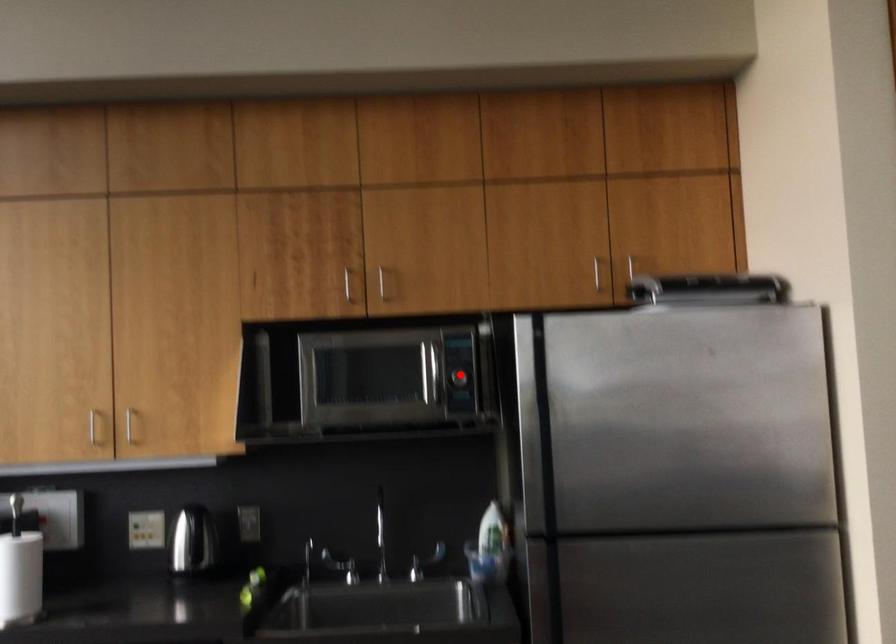
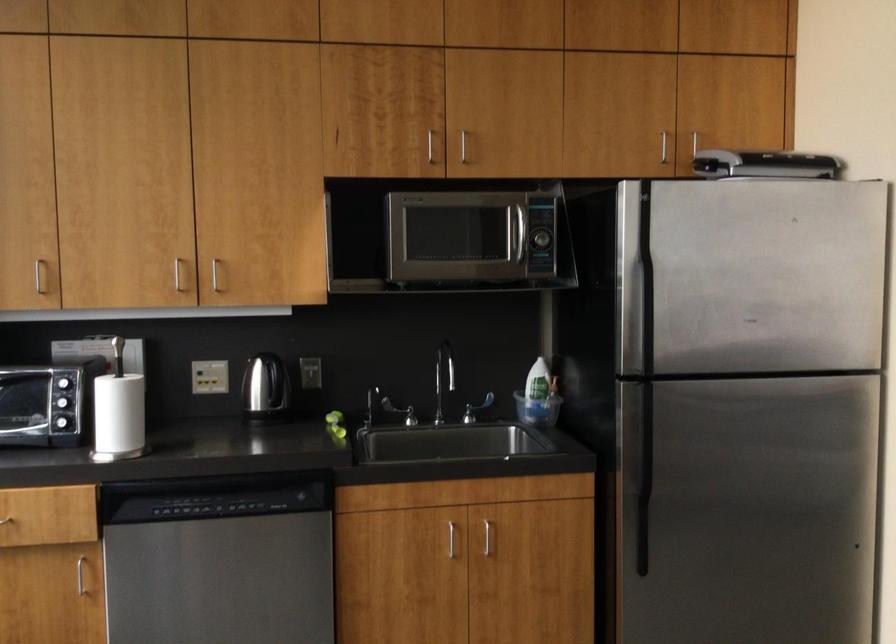
Find the pixel in the second image that matches the highlighted location in the first image.

(540, 239)